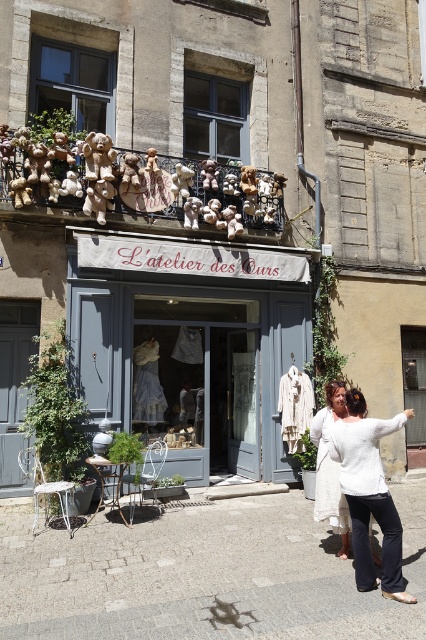
Question: Which object is closer to the camera taking this photo?

Choices:
 (A) white cotton sweater at center
 (B) matte gray storefront at center
 (C) white cotton dress at center

Answer: (A)

Question: Based on their relative distances, which object is farther from the matte gray storefront at center?

Choices:
 (A) matte glass window at upper left
 (B) white cotton dress at center
 (C) white cotton sweater at center

Answer: (C)

Question: Can you confirm if matte gray storefront at center is smaller than matte glass window at upper left?

Choices:
 (A) no
 (B) yes

Answer: (A)

Question: Which object is farther from the camera taking this photo?

Choices:
 (A) matte gray storefront at center
 (B) white cotton sweater at center
 (C) white cotton dress at center

Answer: (A)

Question: Observing the image, what is the correct spatial positioning of white cotton sweater at center in reference to white cotton dress at center?

Choices:
 (A) left
 (B) right

Answer: (B)

Question: Can you confirm if white cotton sweater at center is positioned to the right of white cotton dress at center?

Choices:
 (A) no
 (B) yes

Answer: (B)